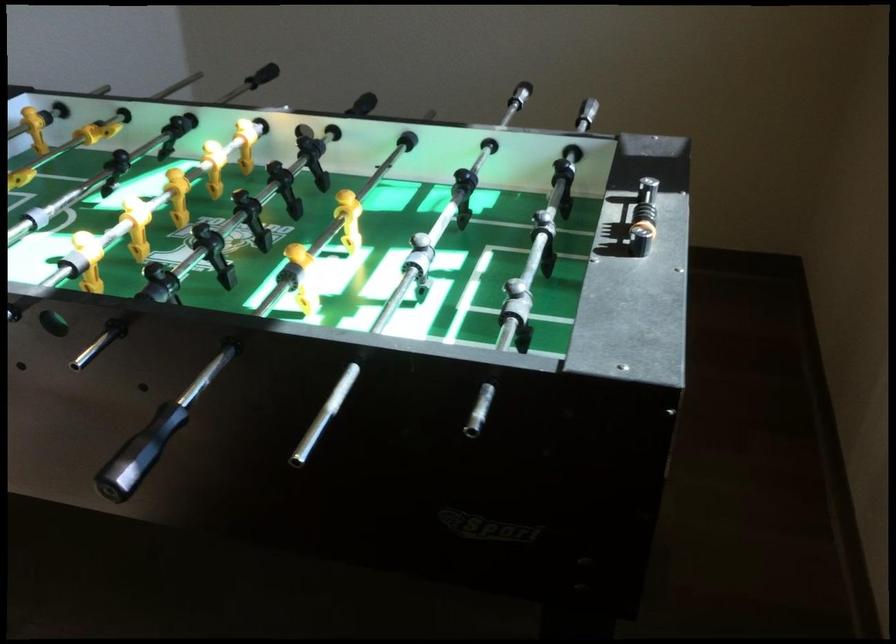
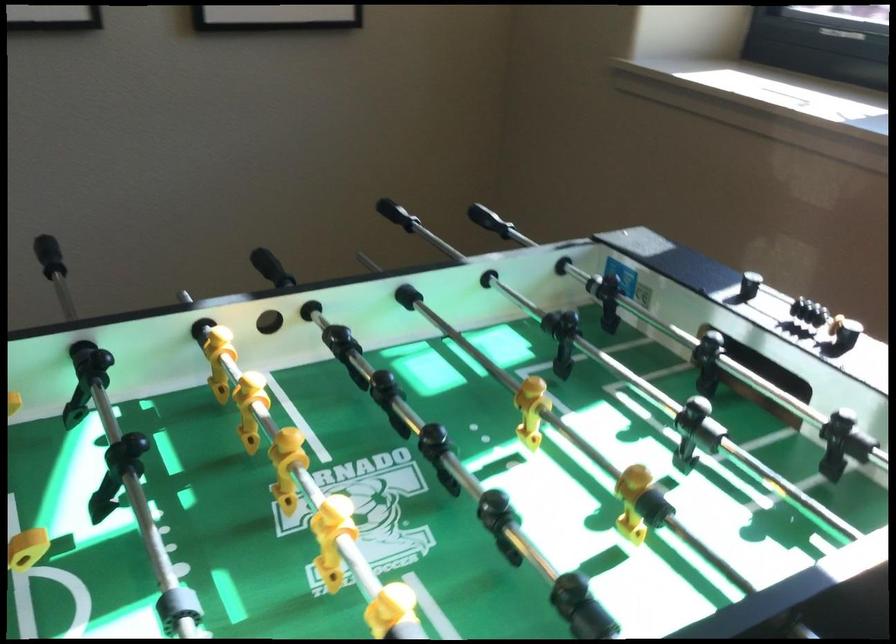
The point at (709,131) is marked in the first image. Where is the corresponding point in the second image?

(397, 214)